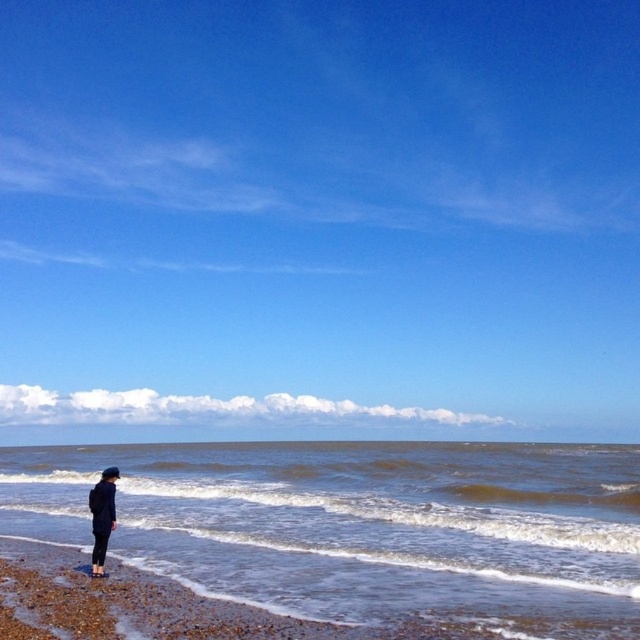
Is brown liquid water at lower left below dark blue fabric jacket at lower left?

Indeed, brown liquid water at lower left is positioned under dark blue fabric jacket at lower left.

Who is more distant from viewer, (321,577) or (100,573)?

The point (321,577) is more distant.

Where is `brown liquid water at lower left`? brown liquid water at lower left is located at coordinates (364, 525).